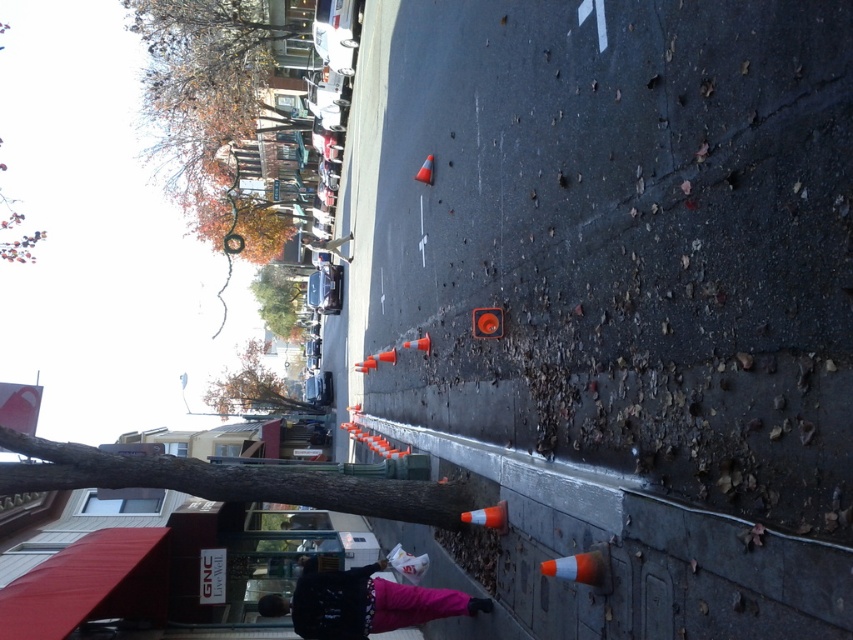
You are a delivery person trying to navigate through the blocked street. You see the black fleece jacket at lower center and the green leafy tree at upper left. Which object is positioned to the right of the other?

The black fleece jacket at lower center is to the right of the green leafy tree at upper left.

You are a delivery driver with a 5.5 meter long truck. You need to drive through the street shown in the image. The path between the orange reflective cone at lower center and the orange reflective cone at center is blocked by debris. Can your truck maneuver around the debris without hitting the cones?

The distance between the orange reflective cone at lower center and the orange reflective cone at center is 6.28 meters. Since your truck is 5.5 meters long, it can safely maneuver around the debris as the space between the cones is wider than the truck.

You are a delivery person carrying a large package and need to navigate through the street blocked by orange traffic cones. You see a black fleece jacket at lower center and an orange reflective cone at center. Which object is bigger in size?

The black fleece jacket at lower center is larger in size compared to the orange reflective cone at center, so the jacket is bigger.